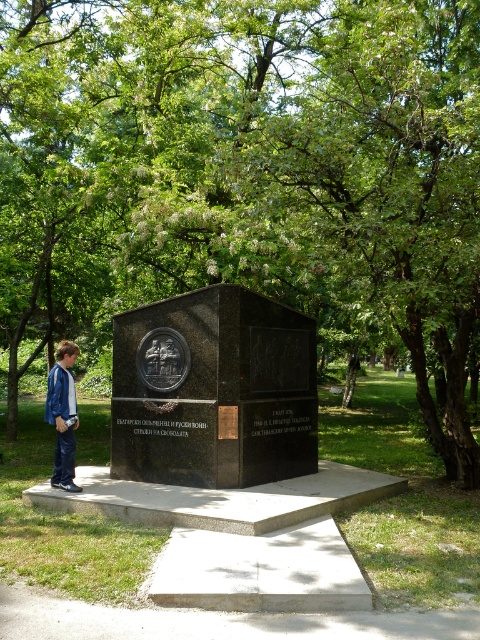
You are a photographer aiming to capture the black polished stone monument at center and the blue denim jacket at lower left in a single frame. Considering their sizes, which object should you focus on to ensure both are clearly visible in the photo?

The black polished stone monument at center is taller than the blue denim jacket at lower left, so focusing on the monument will help ensure both objects are clearly visible in the photo.

You are standing in the park and see the black polished stone monument at center and the blue denim jacket at lower left. Which object is positioned to the right of the other?

The black polished stone monument at center is to the right of the blue denim jacket at lower left.